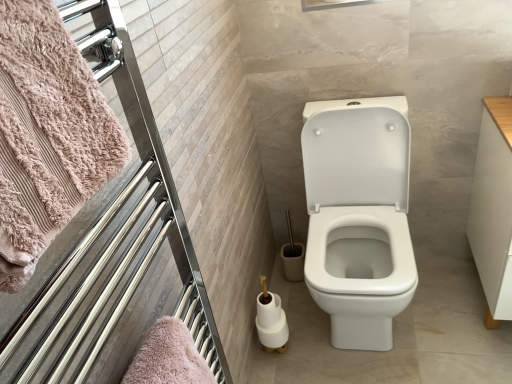
What do you see at coordinates (493, 209) in the screenshot? I see `white wood drawer at right` at bounding box center [493, 209].

This screenshot has width=512, height=384. Identify the location of white glossy toilet paper at lower center, which is counted as the first toilet paper, starting from the bottom. (271, 320).

From a real-world perspective, is white wood drawer at right located higher than white glossy toilet paper at lower center, placed as the 2th toilet paper when sorted from bottom to top?

Yes, from a real-world perspective, white wood drawer at right is above white glossy toilet paper at lower center, placed as the 2th toilet paper when sorted from bottom to top.

From the image's perspective, is white wood drawer at right beneath white glossy toilet paper at lower center, placed as the 2th toilet paper when sorted from bottom to top?

No, from the image's perspective, white wood drawer at right is not below white glossy toilet paper at lower center, placed as the 2th toilet paper when sorted from bottom to top.

Which of these two, white wood drawer at right or white glossy toilet paper at lower center, which is the 1th toilet paper in top-to-bottom order, is thinner?

white glossy toilet paper at lower center, which is the 1th toilet paper in top-to-bottom order, is thinner.

Could you tell me if white wood drawer at right is facing white glossy toilet paper at lower center, which is the 1th toilet paper in top-to-bottom order?

No, white wood drawer at right is not facing towards white glossy toilet paper at lower center, which is the 1th toilet paper in top-to-bottom order.

From the image's perspective, which is above, chrome metallic towel rack at upper left or white glossy toilet paper at lower center, the 2th toilet paper in the top-to-bottom sequence?

chrome metallic towel rack at upper left appears higher in the image.

In the scene shown: Can you tell me how much chrome metallic towel rack at upper left and white glossy toilet paper at lower center, the 2th toilet paper in the top-to-bottom sequence, differ in facing direction?

The angle between the facing direction of chrome metallic towel rack at upper left and the facing direction of white glossy toilet paper at lower center, the 2th toilet paper in the top-to-bottom sequence, is 88 degrees.

Considering the points (38, 343) and (271, 326), which point is behind, point (38, 343) or point (271, 326)?

Positioned behind is point (271, 326).

This screenshot has height=384, width=512. I want to click on the 2nd toilet paper directly beneath the chrome metallic towel rack at upper left (from a real-world perspective), so click(271, 320).

From the picture: Considering the sizes of white glossy toilet paper at lower center, which is counted as the first toilet paper, starting from the bottom, and white wood drawer at right in the image, is white glossy toilet paper at lower center, which is counted as the first toilet paper, starting from the bottom, taller or shorter than white wood drawer at right?

In the image, white glossy toilet paper at lower center, which is counted as the first toilet paper, starting from the bottom, appears to be shorter than white wood drawer at right.

Does white glossy toilet paper at lower center, which is counted as the first toilet paper, starting from the bottom, have a smaller size compared to white wood drawer at right?

Indeed, white glossy toilet paper at lower center, which is counted as the first toilet paper, starting from the bottom, has a smaller size compared to white wood drawer at right.

Is white glossy toilet paper at lower center, which is counted as the first toilet paper, starting from the bottom, turned away from white wood drawer at right?

No, white glossy toilet paper at lower center, which is counted as the first toilet paper, starting from the bottom, is not facing away from white wood drawer at right.

From a real-world perspective, who is located lower, white glossy toilet paper at lower center, the 2th toilet paper in the top-to-bottom sequence, or white wood drawer at right?

From a 3D spatial view, white glossy toilet paper at lower center, the 2th toilet paper in the top-to-bottom sequence, is below.

Which of these two, white glossy toilet paper at lower center, placed as the 2th toilet paper when sorted from bottom to top, or chrome metallic towel rack at upper left, stands taller?

With more height is chrome metallic towel rack at upper left.

From the picture: Considering the positions of objects white glossy toilet paper at lower center, placed as the 2th toilet paper when sorted from bottom to top, and chrome metallic towel rack at upper left in the image provided, who is in front, white glossy toilet paper at lower center, placed as the 2th toilet paper when sorted from bottom to top, or chrome metallic towel rack at upper left?

chrome metallic towel rack at upper left.

Which of these two, white glossy toilet paper at lower center, placed as the 2th toilet paper when sorted from bottom to top, or chrome metallic towel rack at upper left, is smaller?

With smaller size is white glossy toilet paper at lower center, placed as the 2th toilet paper when sorted from bottom to top.

Is white glossy toilet paper at lower center, which is counted as the first toilet paper, starting from the bottom, bigger than white glossy toilet paper at lower center, placed as the 2th toilet paper when sorted from bottom to top?

Yes, white glossy toilet paper at lower center, which is counted as the first toilet paper, starting from the bottom, is bigger than white glossy toilet paper at lower center, placed as the 2th toilet paper when sorted from bottom to top.

Measure the distance from white glossy toilet paper at lower center, which is counted as the first toilet paper, starting from the bottom, to white glossy toilet paper at lower center, which is the 1th toilet paper in top-to-bottom order.

The distance of white glossy toilet paper at lower center, which is counted as the first toilet paper, starting from the bottom, from white glossy toilet paper at lower center, which is the 1th toilet paper in top-to-bottom order, is 1.40 inches.

Does white glossy toilet paper at lower center, which is counted as the first toilet paper, starting from the bottom, come behind white glossy toilet paper at lower center, placed as the 2th toilet paper when sorted from bottom to top?

No, white glossy toilet paper at lower center, which is counted as the first toilet paper, starting from the bottom, is closer to the viewer.

Can you confirm if white glossy toilet paper at lower center, which is counted as the first toilet paper, starting from the bottom, is wider than white glossy toilet paper at lower center, placed as the 2th toilet paper when sorted from bottom to top?

In fact, white glossy toilet paper at lower center, which is counted as the first toilet paper, starting from the bottom, might be narrower than white glossy toilet paper at lower center, placed as the 2th toilet paper when sorted from bottom to top.

From a real-world perspective, does pink fluffy towel at left sit lower than chrome metallic towel rack at upper left?

No, from a real-world perspective, pink fluffy towel at left is not beneath chrome metallic towel rack at upper left.

Is pink fluffy towel at left situated inside chrome metallic towel rack at upper left or outside?

pink fluffy towel at left is contained in chrome metallic towel rack at upper left.

Between point (0, 90) and point (104, 247), which one is positioned in front?

The point (0, 90) is in front.

Which object is more forward, pink fluffy towel at left or chrome metallic towel rack at upper left?

pink fluffy towel at left is in front.

The height and width of the screenshot is (384, 512). Find the location of `bath towel that is in front of the white glossy toilet paper at lower center, placed as the 2th toilet paper when sorted from bottom to top`. bath towel that is in front of the white glossy toilet paper at lower center, placed as the 2th toilet paper when sorted from bottom to top is located at coordinates (47, 135).

Considering the sizes of objects pink fluffy towel at left and white glossy toilet paper at lower center, which is the 1th toilet paper in top-to-bottom order, in the image provided, who is taller, pink fluffy towel at left or white glossy toilet paper at lower center, which is the 1th toilet paper in top-to-bottom order,?

pink fluffy towel at left.

Is pink fluffy towel at left completely or partially outside of white glossy toilet paper at lower center, placed as the 2th toilet paper when sorted from bottom to top?

Indeed, pink fluffy towel at left is completely outside white glossy toilet paper at lower center, placed as the 2th toilet paper when sorted from bottom to top.

Which object is wider, pink fluffy towel at left or white glossy toilet paper at lower center, which is the 1th toilet paper in top-to-bottom order?

pink fluffy towel at left is wider.

I want to click on drawer above the white glossy toilet paper at lower center, which is the 1th toilet paper in top-to-bottom order (from the image's perspective), so click(493, 209).

What are the coordinates of `toilet paper that is the 2nd one below the chrome metallic towel rack at upper left (from a real-world perspective)` in the screenshot? It's located at [x=271, y=320].

Looking at the image, which one is located closer to pink fluffy towel at left, chrome metallic towel rack at upper left or white glossy toilet paper at lower center, which is counted as the first toilet paper, starting from the bottom?

chrome metallic towel rack at upper left.

From the image, which object appears to be farther from chrome metallic towel rack at upper left, white wood drawer at right or white glossy toilet paper at lower center, placed as the 2th toilet paper when sorted from bottom to top?

The object further to chrome metallic towel rack at upper left is white wood drawer at right.

When comparing their distances from pink fluffy towel at left, does white wood drawer at right or white glossy toilet paper at lower center, which is counted as the first toilet paper, starting from the bottom, seem closer?

white glossy toilet paper at lower center, which is counted as the first toilet paper, starting from the bottom.

Looking at this image, considering their positions, is pink fluffy towel at left positioned closer to chrome metallic towel rack at upper left than white glossy toilet paper at lower center, which is the 1th toilet paper in top-to-bottom order?

Based on the image, pink fluffy towel at left appears to be nearer to chrome metallic towel rack at upper left.

Considering their positions, is chrome metallic towel rack at upper left positioned closer to white glossy toilet paper at lower center, the 2th toilet paper in the top-to-bottom sequence, than white glossy toilet paper at lower center, placed as the 2th toilet paper when sorted from bottom to top?

white glossy toilet paper at lower center, placed as the 2th toilet paper when sorted from bottom to top, is closer to white glossy toilet paper at lower center, the 2th toilet paper in the top-to-bottom sequence.

Considering their positions, is white glossy toilet paper at lower center, which is counted as the first toilet paper, starting from the bottom, positioned further to pink fluffy towel at left than white glossy toilet paper at lower center, placed as the 2th toilet paper when sorted from bottom to top?

white glossy toilet paper at lower center, which is counted as the first toilet paper, starting from the bottom.

Based on their spatial positions, is white wood drawer at right or white glossy toilet paper at lower center, which is the 1th toilet paper in top-to-bottom order, further from pink fluffy towel at left?

Among the two, white wood drawer at right is located further to pink fluffy towel at left.

Considering their positions, is chrome metallic towel rack at upper left positioned closer to white glossy toilet paper at lower center, placed as the 2th toilet paper when sorted from bottom to top, than white glossy toilet paper at lower center, the 2th toilet paper in the top-to-bottom sequence?

Among the two, white glossy toilet paper at lower center, the 2th toilet paper in the top-to-bottom sequence, is located nearer to white glossy toilet paper at lower center, placed as the 2th toilet paper when sorted from bottom to top.

Where is `toilet paper situated between white glossy toilet paper at lower center, which is the 1th toilet paper in top-to-bottom order, and white wood drawer at right from left to right`? This screenshot has height=384, width=512. toilet paper situated between white glossy toilet paper at lower center, which is the 1th toilet paper in top-to-bottom order, and white wood drawer at right from left to right is located at coordinates (271, 320).

Where is `drawer positioned between pink fluffy towel at left and white glossy toilet paper at lower center, placed as the 2th toilet paper when sorted from bottom to top, from near to far`? The width and height of the screenshot is (512, 384). drawer positioned between pink fluffy towel at left and white glossy toilet paper at lower center, placed as the 2th toilet paper when sorted from bottom to top, from near to far is located at coordinates (493, 209).

Where is `screen door located between pink fluffy towel at left and white glossy toilet paper at lower center, the 2th toilet paper in the top-to-bottom sequence, in the depth direction`? screen door located between pink fluffy towel at left and white glossy toilet paper at lower center, the 2th toilet paper in the top-to-bottom sequence, in the depth direction is located at coordinates 113,244.

I want to click on toilet paper between pink fluffy towel at left and white glossy toilet paper at lower center, which is the 1th toilet paper in top-to-bottom order, along the z-axis, so click(271, 320).